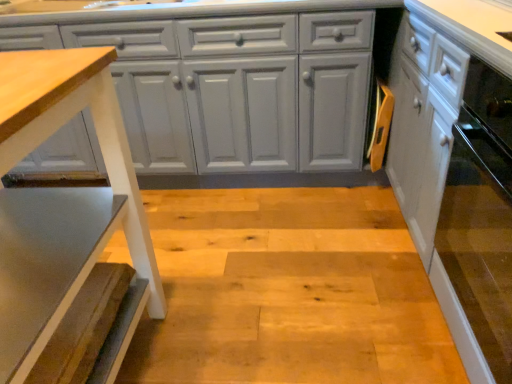
Question: Choose the correct answer: Is wooden textured step stool at left inside matte gray cabinet at center, which appears as the 1th cabinetry when viewed from the left, or outside it?

Choices:
 (A) inside
 (B) outside

Answer: (B)

Question: From their relative heights in the image, would you say wooden textured step stool at left is taller or shorter than matte gray cabinet at center, which appears as the 1th cabinetry when viewed from the left?

Choices:
 (A) tall
 (B) short

Answer: (B)

Question: Which object is positioned closest to the white glossy cabinet at right, placed as the 2th cabinetry when sorted from left to right?

Choices:
 (A) matte gray cabinet at center, which appears as the 1th cabinetry when viewed from the left
 (B) wooden textured step stool at left

Answer: (A)

Question: Estimate the real-world distances between objects in this image. Which object is farther from the matte gray cabinet at center, which ranks as the 2th cabinetry in right-to-left order?

Choices:
 (A) white glossy cabinet at right, placed as the 2th cabinetry when sorted from left to right
 (B) wooden textured step stool at left

Answer: (B)